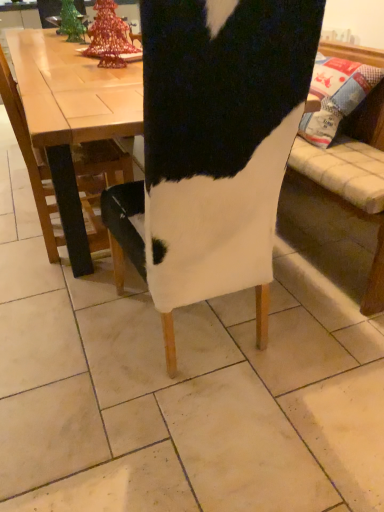
Where is `white fabric chair at center, the second chair viewed from the left`? The width and height of the screenshot is (384, 512). white fabric chair at center, the second chair viewed from the left is located at coordinates (214, 147).

What is the approximate width of white fabric chair at center, the 1th chair positioned from the right?

It is 25.56 inches.

This screenshot has height=512, width=384. What do you see at coordinates (214, 147) in the screenshot? I see `white fabric chair at center, the 1th chair positioned from the right` at bounding box center [214, 147].

At what (x,y) coordinates should I click in order to perform the action: click on white fabric chair at left, the second chair in the right-to-left sequence. Please return your answer as a coordinate pair (x, y). The width and height of the screenshot is (384, 512). Looking at the image, I should click on (31, 160).

Describe the element at coordinates (31, 160) in the screenshot. The height and width of the screenshot is (512, 384). I see `white fabric chair at left, the 1th chair in the left-to-right sequence` at that location.

The width and height of the screenshot is (384, 512). I want to click on white fabric chair at center, the 1th chair positioned from the right, so click(x=214, y=147).

Considering the relative positions of white fabric chair at left, the 1th chair in the left-to-right sequence, and white fabric chair at center, the second chair viewed from the left, in the image provided, is white fabric chair at left, the 1th chair in the left-to-right sequence, to the left of white fabric chair at center, the second chair viewed from the left, from the viewer's perspective?

Correct, you'll find white fabric chair at left, the 1th chair in the left-to-right sequence, to the left of white fabric chair at center, the second chair viewed from the left.

Is the position of white fabric chair at left, the 1th chair in the left-to-right sequence, less distant than that of white fabric chair at center, the 1th chair positioned from the right?

No.

Between point (92, 144) and point (256, 253), which one is positioned in front?

The point (256, 253) is more forward.

From the image's perspective, is white fabric chair at left, the 1th chair in the left-to-right sequence, on top of white fabric chair at center, the second chair viewed from the left?

Yes, from the image's perspective, white fabric chair at left, the 1th chair in the left-to-right sequence, is on top of white fabric chair at center, the second chair viewed from the left.

From a real-world perspective, between white fabric chair at left, the 1th chair in the left-to-right sequence, and white fabric chair at center, the 1th chair positioned from the right, who is vertically higher?

white fabric chair at center, the 1th chair positioned from the right.

Does white fabric chair at left, the second chair in the right-to-left sequence, have a lesser width compared to white fabric chair at center, the second chair viewed from the left?

Correct, the width of white fabric chair at left, the second chair in the right-to-left sequence, is less than that of white fabric chair at center, the second chair viewed from the left.

From the picture: Which of these two, white fabric chair at left, the 1th chair in the left-to-right sequence, or white fabric chair at center, the 1th chair positioned from the right, stands taller?

With more height is white fabric chair at center, the 1th chair positioned from the right.

Considering the sizes of objects white fabric chair at left, the second chair in the right-to-left sequence, and white fabric chair at center, the 1th chair positioned from the right, in the image provided, who is bigger, white fabric chair at left, the second chair in the right-to-left sequence, or white fabric chair at center, the 1th chair positioned from the right,?

Bigger between the two is white fabric chair at center, the 1th chair positioned from the right.

Is white fabric chair at center, the second chair viewed from the left, completely or partially inside white fabric chair at left, the 1th chair in the left-to-right sequence?

No, white fabric chair at center, the second chair viewed from the left, is not inside white fabric chair at left, the 1th chair in the left-to-right sequence.

Is white fabric chair at left, the 1th chair in the left-to-right sequence, with white fabric chair at center, the second chair viewed from the left?

No, white fabric chair at left, the 1th chair in the left-to-right sequence, is not next to white fabric chair at center, the second chair viewed from the left.

Is white fabric chair at left, the 1th chair in the left-to-right sequence, oriented towards white fabric chair at center, the second chair viewed from the left?

No, white fabric chair at left, the 1th chair in the left-to-right sequence, is not oriented towards white fabric chair at center, the second chair viewed from the left.

What's the angular difference between white fabric chair at left, the 1th chair in the left-to-right sequence, and white fabric chair at center, the second chair viewed from the left,'s facing directions?

They differ by 88.7 degrees in their facing directions.

Identify the location of chair below the white fabric chair at left, the second chair in the right-to-left sequence (from the image's perspective). (214, 147).

Which object is positioned more to the left, white fabric chair at center, the 1th chair positioned from the right, or white fabric chair at left, the 1th chair in the left-to-right sequence?

white fabric chair at left, the 1th chair in the left-to-right sequence, is more to the left.

Considering their positions, is white fabric chair at center, the second chair viewed from the left, located in front of or behind white fabric chair at left, the 1th chair in the left-to-right sequence?

white fabric chair at center, the second chair viewed from the left, is positioned closer to the viewer than white fabric chair at left, the 1th chair in the left-to-right sequence.

Which is in front, point (171, 321) or point (115, 146)?

The point (171, 321) is closer to the camera.

From the image's perspective, which is above, white fabric chair at center, the 1th chair positioned from the right, or white fabric chair at left, the second chair in the right-to-left sequence?

white fabric chair at left, the second chair in the right-to-left sequence, appears higher in the image.

From a real-world perspective, is white fabric chair at center, the 1th chair positioned from the right, physically below white fabric chair at left, the 1th chair in the left-to-right sequence?

Actually, white fabric chair at center, the 1th chair positioned from the right, is physically above white fabric chair at left, the 1th chair in the left-to-right sequence, in the real world.

Between white fabric chair at center, the 1th chair positioned from the right, and white fabric chair at left, the 1th chair in the left-to-right sequence, which one has larger width?

white fabric chair at center, the 1th chair positioned from the right.

From the picture: Can you confirm if white fabric chair at center, the second chair viewed from the left, is taller than white fabric chair at left, the 1th chair in the left-to-right sequence?

Yes.

Which of these two, white fabric chair at center, the 1th chair positioned from the right, or white fabric chair at left, the 1th chair in the left-to-right sequence, is smaller?

With smaller size is white fabric chair at left, the 1th chair in the left-to-right sequence.

Is white fabric chair at center, the 1th chair positioned from the right, outside of white fabric chair at left, the second chair in the right-to-left sequence?

That's correct, white fabric chair at center, the 1th chair positioned from the right, is outside of white fabric chair at left, the second chair in the right-to-left sequence.

Are white fabric chair at center, the 1th chair positioned from the right, and white fabric chair at left, the second chair in the right-to-left sequence, located far from each other?

Actually, white fabric chair at center, the 1th chair positioned from the right, and white fabric chair at left, the second chair in the right-to-left sequence, are a little close together.

Does white fabric chair at center, the 1th chair positioned from the right, turn towards white fabric chair at left, the second chair in the right-to-left sequence?

Yes, white fabric chair at center, the 1th chair positioned from the right, is turned towards white fabric chair at left, the second chair in the right-to-left sequence.

Can you tell me how much white fabric chair at center, the 1th chair positioned from the right, and white fabric chair at left, the 1th chair in the left-to-right sequence, differ in facing direction?

The angle between the facing direction of white fabric chair at center, the 1th chair positioned from the right, and the facing direction of white fabric chair at left, the 1th chair in the left-to-right sequence, is 88.7 degrees.

Find the location of a particular element. chair that appears above the white fabric chair at center, the 1th chair positioned from the right (from the image's perspective) is located at coordinates (31, 160).

Where is `chair below the white fabric chair at left, the 1th chair in the left-to-right sequence (from the image's perspective)`? The height and width of the screenshot is (512, 384). chair below the white fabric chair at left, the 1th chair in the left-to-right sequence (from the image's perspective) is located at coordinates (214, 147).

This screenshot has height=512, width=384. I want to click on chair in front of the white fabric chair at left, the 1th chair in the left-to-right sequence, so click(x=214, y=147).